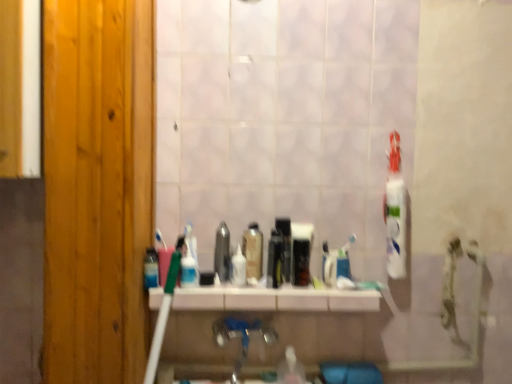
What do you see at coordinates (97, 187) in the screenshot? I see `wooden door at left` at bounding box center [97, 187].

What is the approximate height of white plastic toothbrush at center?

5.04 inches.

This screenshot has width=512, height=384. What do you see at coordinates (238, 268) in the screenshot?
I see `translucent plastic mouthwash at center, which appears as the fifth mouthwash when viewed from the right` at bounding box center [238, 268].

The width and height of the screenshot is (512, 384). What do you see at coordinates (189, 269) in the screenshot?
I see `translucent plastic mouthwash at center, positioned as the seventh mouthwash in right-to-left order` at bounding box center [189, 269].

Locate an element on the screen. Image resolution: width=512 pixels, height=384 pixels. black glossy mouthwash at center, acting as the 8th mouthwash starting from the left is located at coordinates (300, 262).

From the picture: Can you tell me how much metallic silver mouthwash at center, which ranks as the 6th mouthwash in right-to-left order, and black plastic mouthwash at center, which appears as the seventh mouthwash when viewed from the left, differ in facing direction?

They differ by 2.71 degrees in their facing directions.

Based on their positions, is metallic silver mouthwash at center, which is counted as the third mouthwash, starting from the left, located to the left or right of black plastic mouthwash at center, the second mouthwash positioned from the right?

metallic silver mouthwash at center, which is counted as the third mouthwash, starting from the left, is to the left of black plastic mouthwash at center, the second mouthwash positioned from the right.

Which of these two, metallic silver mouthwash at center, which is counted as the third mouthwash, starting from the left, or black plastic mouthwash at center, which appears as the seventh mouthwash when viewed from the left, is wider?

With larger width is black plastic mouthwash at center, which appears as the seventh mouthwash when viewed from the left.

Choose the correct answer: Is metallic silver mouthwash at center, which ranks as the 6th mouthwash in right-to-left order, inside translucent plastic mouthwash at center, which appears as the fifth mouthwash when viewed from the right, or outside it?

metallic silver mouthwash at center, which ranks as the 6th mouthwash in right-to-left order, is located beyond the bounds of translucent plastic mouthwash at center, which appears as the fifth mouthwash when viewed from the right.

Is metallic silver mouthwash at center, which ranks as the 6th mouthwash in right-to-left order, looking in the opposite direction of translucent plastic mouthwash at center, which appears as the fifth mouthwash when viewed from the right?

No, translucent plastic mouthwash at center, which appears as the fifth mouthwash when viewed from the right, is not at the back of metallic silver mouthwash at center, which ranks as the 6th mouthwash in right-to-left order.

Can you tell me how much metallic silver mouthwash at center, which ranks as the 6th mouthwash in right-to-left order, and translucent plastic mouthwash at center, marked as the 4th mouthwash in a left-to-right arrangement, differ in facing direction?

The angular difference between metallic silver mouthwash at center, which ranks as the 6th mouthwash in right-to-left order, and translucent plastic mouthwash at center, marked as the 4th mouthwash in a left-to-right arrangement, is 0.00383 degrees.

From the image's perspective, does metallic silver mouthwash at center, which ranks as the 6th mouthwash in right-to-left order, appear higher than translucent plastic mouthwash at center, marked as the 4th mouthwash in a left-to-right arrangement?

Indeed, from the image's perspective, metallic silver mouthwash at center, which ranks as the 6th mouthwash in right-to-left order, is shown above translucent plastic mouthwash at center, marked as the 4th mouthwash in a left-to-right arrangement.

Consider the image. Does translucent plastic mouthwash at center, placed as the 6th mouthwash when sorted from left to right, have a greater width compared to translucent plastic mouthwash at center, marked as the 4th mouthwash in a left-to-right arrangement?

Correct, the width of translucent plastic mouthwash at center, placed as the 6th mouthwash when sorted from left to right, exceeds that of translucent plastic mouthwash at center, marked as the 4th mouthwash in a left-to-right arrangement.

Would you say translucent plastic mouthwash at center, the 3th mouthwash positioned from the right, is to the left or to the right of translucent plastic mouthwash at center, marked as the 4th mouthwash in a left-to-right arrangement, in the picture?

translucent plastic mouthwash at center, the 3th mouthwash positioned from the right, is to the right of translucent plastic mouthwash at center, marked as the 4th mouthwash in a left-to-right arrangement.

Is translucent plastic mouthwash at center, the 3th mouthwash positioned from the right, located outside translucent plastic mouthwash at center, which appears as the fifth mouthwash when viewed from the right?

Indeed, translucent plastic mouthwash at center, the 3th mouthwash positioned from the right, is completely outside translucent plastic mouthwash at center, which appears as the fifth mouthwash when viewed from the right.

From the picture: Between translucent plastic mouthwash at center, the 3th mouthwash positioned from the right, and translucent plastic mouthwash at center, which appears as the fifth mouthwash when viewed from the right, which one has less height?

translucent plastic mouthwash at center, which appears as the fifth mouthwash when viewed from the right.

Considering the sizes of black plastic mouthwash at center, the second mouthwash positioned from the right, and translucent plastic mouthwash at center, the 3th mouthwash positioned from the right, in the image, is black plastic mouthwash at center, the second mouthwash positioned from the right, taller or shorter than translucent plastic mouthwash at center, the 3th mouthwash positioned from the right,?

Clearly, black plastic mouthwash at center, the second mouthwash positioned from the right, is taller compared to translucent plastic mouthwash at center, the 3th mouthwash positioned from the right.

Is black plastic mouthwash at center, which appears as the seventh mouthwash when viewed from the left, looking in the opposite direction of translucent plastic mouthwash at center, the 3th mouthwash positioned from the right?

No, black plastic mouthwash at center, which appears as the seventh mouthwash when viewed from the left,'s orientation is not away from translucent plastic mouthwash at center, the 3th mouthwash positioned from the right.

Is black plastic mouthwash at center, the second mouthwash positioned from the right, situated inside translucent plastic mouthwash at center, placed as the 6th mouthwash when sorted from left to right, or outside?

black plastic mouthwash at center, the second mouthwash positioned from the right, is located beyond the bounds of translucent plastic mouthwash at center, placed as the 6th mouthwash when sorted from left to right.

From the image's perspective, which one is positioned lower, black plastic mouthwash at center, which appears as the seventh mouthwash when viewed from the left, or translucent plastic mouthwash at center, the 3th mouthwash positioned from the right?

translucent plastic mouthwash at center, the 3th mouthwash positioned from the right.

In the scene shown: In terms of height, does translucent plastic mouthwash at center, which appears as the fifth mouthwash when viewed from the right, look taller or shorter compared to translucent plastic mouthwash at center, the 2th mouthwash positioned from the left?

In the image, translucent plastic mouthwash at center, which appears as the fifth mouthwash when viewed from the right, appears to be taller than translucent plastic mouthwash at center, the 2th mouthwash positioned from the left.

Between point (245, 269) and point (184, 256), which one is positioned behind?

Positioned behind is point (245, 269).

From the picture: How different are the orientations of translucent plastic mouthwash at center, marked as the 4th mouthwash in a left-to-right arrangement, and translucent plastic mouthwash at center, the 2th mouthwash positioned from the left, in degrees?

translucent plastic mouthwash at center, marked as the 4th mouthwash in a left-to-right arrangement, and translucent plastic mouthwash at center, the 2th mouthwash positioned from the left, are facing 0.833 degrees away from each other.

From a real-world perspective, is translucent plastic mouthwash at center, which appears as the fifth mouthwash when viewed from the right, on top of blue glossy bottle at center, which ranks as the 1th mouthwash in left-to-right order?

Indeed, from a real-world perspective, translucent plastic mouthwash at center, which appears as the fifth mouthwash when viewed from the right, stands above blue glossy bottle at center, which ranks as the 1th mouthwash in left-to-right order.

How different are the orientations of translucent plastic mouthwash at center, which appears as the fifth mouthwash when viewed from the right, and blue glossy bottle at center, which ranks as the eighth mouthwash in right-to-left order, in degrees?

The facing directions of translucent plastic mouthwash at center, which appears as the fifth mouthwash when viewed from the right, and blue glossy bottle at center, which ranks as the eighth mouthwash in right-to-left order, are 0.833 degrees apart.

Is translucent plastic mouthwash at center, marked as the 4th mouthwash in a left-to-right arrangement, smaller than blue glossy bottle at center, which ranks as the 1th mouthwash in left-to-right order?

No, translucent plastic mouthwash at center, marked as the 4th mouthwash in a left-to-right arrangement, is not smaller than blue glossy bottle at center, which ranks as the 1th mouthwash in left-to-right order.

Based on the photo, is translucent plastic mouthwash at center, which appears as the fifth mouthwash when viewed from the right, at the right side of blue glossy bottle at center, which ranks as the eighth mouthwash in right-to-left order?

Yes, translucent plastic mouthwash at center, which appears as the fifth mouthwash when viewed from the right, is to the right of blue glossy bottle at center, which ranks as the eighth mouthwash in right-to-left order.

Is black glossy mouthwash at center, acting as the 8th mouthwash starting from the left, turned away from wooden door at left?

No, black glossy mouthwash at center, acting as the 8th mouthwash starting from the left, is not facing the opposite direction of wooden door at left.

Is point (295, 277) closer or farther from the camera than point (44, 31)?

Point (295, 277) appears to be farther away from the viewer than point (44, 31).

Which object is positioned more to the left, black glossy mouthwash at center, acting as the 8th mouthwash starting from the left, or wooden door at left?

Positioned to the left is wooden door at left.

Is black glossy mouthwash at center, acting as the 8th mouthwash starting from the left, beside wooden door at left?

They are not placed beside each other.

From the image's perspective, which mouthwash is the 2nd one below the black plastic mouthwash at center, the second mouthwash positioned from the right? Please provide its 2D coordinates.

[(222, 252)]

At what (x,y) coordinates should I click in order to perform the action: click on the 3rd mouthwash above the translucent plastic mouthwash at center, which appears as the fifth mouthwash when viewed from the right (from the image's perspective). Please return your answer as a coordinate pair (x, y). The height and width of the screenshot is (384, 512). Looking at the image, I should click on (222, 252).

Which object lies nearer to the anchor point black plastic mouthwash at center, which appears as the seventh mouthwash when viewed from the left, black glossy mouthwash at center, acting as the 8th mouthwash starting from the left, or wooden door at left?

black glossy mouthwash at center, acting as the 8th mouthwash starting from the left, is closer to black plastic mouthwash at center, which appears as the seventh mouthwash when viewed from the left.

Looking at the image, which one is located further to black plastic mouthwash at center, which appears as the seventh mouthwash when viewed from the left, translucent plastic mouthwash at center, the 2th mouthwash positioned from the left, or wooden door at left?

wooden door at left.

Based on their spatial positions, is white plastic toothbrush at center or blue metallic faucet at center closer to white glossy toothpaste at center?

blue metallic faucet at center.

Looking at the image, which one is located closer to white glossy toothpaste at center, white glossy shelf at center or black glossy mouthwash at center, acting as the 8th mouthwash starting from the left?

The object closer to white glossy toothpaste at center is white glossy shelf at center.

Estimate the real-world distances between objects in this image. Which object is closer to translucent plastic mouthwash at center, marked as the 4th mouthwash in a left-to-right arrangement, matte plastic mouthwash at center, which is the 4th mouthwash from right to left, or blue glossy bottle at center, which ranks as the eighth mouthwash in right-to-left order?

The object closer to translucent plastic mouthwash at center, marked as the 4th mouthwash in a left-to-right arrangement, is matte plastic mouthwash at center, which is the 4th mouthwash from right to left.

Estimate the real-world distances between objects in this image. Which object is further from black glossy mouthwash at center, the first mouthwash in the right-to-left sequence, white plastic toothbrush at center or matte plastic mouthwash at center, which is the 4th mouthwash from right to left?

matte plastic mouthwash at center, which is the 4th mouthwash from right to left, is positioned further to the anchor black glossy mouthwash at center, the first mouthwash in the right-to-left sequence.

Considering their positions, is white plastic toothbrush at center positioned closer to matte plastic mouthwash at center, which is the 4th mouthwash from right to left, than translucent plastic mouthwash at center, which appears as the fifth mouthwash when viewed from the right?

Among the two, translucent plastic mouthwash at center, which appears as the fifth mouthwash when viewed from the right, is located nearer to matte plastic mouthwash at center, which is the 4th mouthwash from right to left.

Based on their spatial positions, is black plastic mouthwash at center, which appears as the seventh mouthwash when viewed from the left, or metallic silver mouthwash at center, which ranks as the 6th mouthwash in right-to-left order, closer to matte plastic mouthwash at center, which is the 4th mouthwash from right to left?

The object closer to matte plastic mouthwash at center, which is the 4th mouthwash from right to left, is metallic silver mouthwash at center, which ranks as the 6th mouthwash in right-to-left order.

Find the location of a particular element. faucet located between white glossy toothpaste at center and black glossy mouthwash at center, the first mouthwash in the right-to-left sequence, in the left-right direction is located at coordinates (241, 337).

Image resolution: width=512 pixels, height=384 pixels. What are the coordinates of `counter top between matte plastic mouthwash at center, which is the 4th mouthwash from right to left, and white plastic toothbrush at center, in the horizontal direction` in the screenshot? It's located at coord(275,299).

The height and width of the screenshot is (384, 512). I want to click on faucet located between blue glossy bottle at center, which ranks as the 1th mouthwash in left-to-right order, and white glossy shelf at center in the left-right direction, so click(241, 337).

Image resolution: width=512 pixels, height=384 pixels. Find the location of `toothpaste between wooden door at left and blue metallic faucet at center in the up-down direction`. toothpaste between wooden door at left and blue metallic faucet at center in the up-down direction is located at coordinates (191, 242).